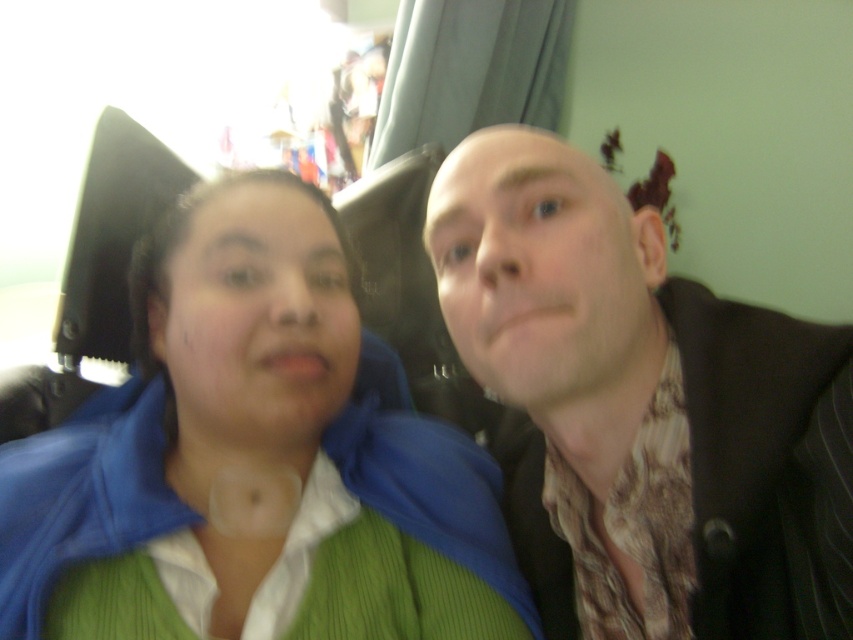
Does green knitted sweater at center have a smaller size compared to brown textured scarf at center?

Actually, green knitted sweater at center might be larger than brown textured scarf at center.

Measure the distance between point [132,422] and camera.

The distance of point [132,422] from camera is 71.91 centimeters.

Identify the location of green knitted sweater at center. (252, 461).